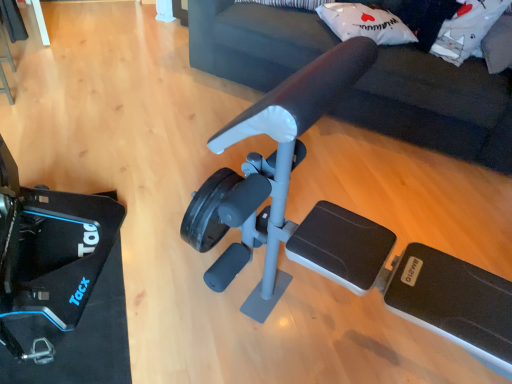
What do you see at coordinates (365, 23) in the screenshot?
I see `white matte pillow at upper center, the 2th pillow in the right-to-left sequence` at bounding box center [365, 23].

What do you see at coordinates (436, 105) in the screenshot?
I see `matte black exercise machine at center` at bounding box center [436, 105].

I want to click on white matte pillow at upper center, positioned as the first pillow in left-to-right order, so click(x=365, y=23).

Is white matte pillow at upper center, the 2th pillow in the right-to-left sequence, taller than white soft pillow at upper right, which is the second pillow from left to right?

No.

I want to click on pillow positioned vertically above the white matte pillow at upper center, the 2th pillow in the right-to-left sequence (from a real-world perspective), so click(498, 45).

Would you say white matte pillow at upper center, positioned as the first pillow in left-to-right order, is inside or outside white soft pillow at upper right, which is the second pillow from left to right?

white matte pillow at upper center, positioned as the first pillow in left-to-right order, is outside white soft pillow at upper right, which is the second pillow from left to right.

Considering the sizes of objects white matte pillow at upper center, positioned as the first pillow in left-to-right order, and white soft pillow at upper right, which is the second pillow from left to right, in the image provided, who is thinner, white matte pillow at upper center, positioned as the first pillow in left-to-right order, or white soft pillow at upper right, which is the second pillow from left to right,?

Thinner between the two is white matte pillow at upper center, positioned as the first pillow in left-to-right order.

Which is in front, white matte pillow at upper center, positioned as the first pillow in left-to-right order, or black matte tacx pedal at lower left?

black matte tacx pedal at lower left is closer to the camera.

Can you confirm if white matte pillow at upper center, the 2th pillow in the right-to-left sequence, is taller than black matte tacx pedal at lower left?

Correct, white matte pillow at upper center, the 2th pillow in the right-to-left sequence, is much taller as black matte tacx pedal at lower left.

Is white matte pillow at upper center, the 2th pillow in the right-to-left sequence, smaller than black matte tacx pedal at lower left?

Incorrect, white matte pillow at upper center, the 2th pillow in the right-to-left sequence, is not smaller in size than black matte tacx pedal at lower left.

From a real-world perspective, which is physically above, white matte pillow at upper center, positioned as the first pillow in left-to-right order, or black matte tacx pedal at lower left?

white matte pillow at upper center, positioned as the first pillow in left-to-right order.

In terms of width, does black matte tacx pedal at lower left look wider or thinner when compared to matte black exercise machine at center?

In the image, black matte tacx pedal at lower left appears to be more narrow than matte black exercise machine at center.

Which of these two, black matte tacx pedal at lower left or matte black exercise machine at center, is smaller?

Smaller between the two is black matte tacx pedal at lower left.

Locate an element on the screen. furniture behind the black matte tacx pedal at lower left is located at coordinates (436, 105).

Is black matte tacx pedal at lower left at the left side of matte black exercise machine at center?

Yes.

Considering the sizes of white matte pillow at upper center, the 2th pillow in the right-to-left sequence, and matte black exercise machine at center in the image, is white matte pillow at upper center, the 2th pillow in the right-to-left sequence, bigger or smaller than matte black exercise machine at center?

white matte pillow at upper center, the 2th pillow in the right-to-left sequence, is smaller than matte black exercise machine at center.

From the image's perspective, which is above, white matte pillow at upper center, positioned as the first pillow in left-to-right order, or matte black exercise machine at center?

From the image's view, matte black exercise machine at center is above.

From a real-world perspective, is white matte pillow at upper center, the 2th pillow in the right-to-left sequence, below matte black exercise machine at center?

Incorrect, from a real-world perspective, white matte pillow at upper center, the 2th pillow in the right-to-left sequence, is higher than matte black exercise machine at center.

Is matte black exercise machine at center inside white matte pillow at upper center, the 2th pillow in the right-to-left sequence?

No, matte black exercise machine at center is located outside of white matte pillow at upper center, the 2th pillow in the right-to-left sequence.

Considering the positions of points (508, 25) and (334, 31), is point (508, 25) farther from camera compared to point (334, 31)?

That is False.

Is white soft pillow at upper right, which is the second pillow from left to right, to the left of white matte pillow at upper center, the 2th pillow in the right-to-left sequence, from the viewer's perspective?

No.

From a real-world perspective, is white soft pillow at upper right, which is the first pillow in right-to-left order, under white matte pillow at upper center, the 2th pillow in the right-to-left sequence?

No, from a real-world perspective, white soft pillow at upper right, which is the first pillow in right-to-left order, is not under white matte pillow at upper center, the 2th pillow in the right-to-left sequence.

From the image's perspective, is black matte tacx pedal at lower left over white soft pillow at upper right, which is the first pillow in right-to-left order?

No, from the image's perspective, black matte tacx pedal at lower left is not on top of white soft pillow at upper right, which is the first pillow in right-to-left order.

Where is `the 2nd pillow positioned above the black matte tacx pedal at lower left (from a real-world perspective)`? the 2nd pillow positioned above the black matte tacx pedal at lower left (from a real-world perspective) is located at coordinates (498, 45).

Between black matte tacx pedal at lower left and white soft pillow at upper right, which is the second pillow from left to right, which one is positioned behind?

white soft pillow at upper right, which is the second pillow from left to right, is more distant.

Measure the distance between black matte tacx pedal at lower left and white soft pillow at upper right, which is the second pillow from left to right.

black matte tacx pedal at lower left is 6.88 feet from white soft pillow at upper right, which is the second pillow from left to right.

Can black matte tacx pedal at lower left be found inside matte black exercise machine at center?

No, black matte tacx pedal at lower left is not inside matte black exercise machine at center.

From the image's perspective, does matte black exercise machine at center appear higher than black matte tacx pedal at lower left?

Correct, matte black exercise machine at center appears higher than black matte tacx pedal at lower left in the image.

How distant is matte black exercise machine at center from black matte tacx pedal at lower left?

matte black exercise machine at center is 1.65 meters away from black matte tacx pedal at lower left.

Where is `video camera that appears on the left of matte black exercise machine at center`? This screenshot has height=384, width=512. video camera that appears on the left of matte black exercise machine at center is located at coordinates (49, 253).

In the image, there is a white soft pillow at upper right, which is the second pillow from left to right. At what (x,y) coordinates should I click in order to perform the action: click on pillow below it (from a real-world perspective). Please return your answer as a coordinate pair (x, y). Looking at the image, I should click on (365, 23).

Where is `the 2nd pillow behind the black matte tacx pedal at lower left, starting your count from the anchor`? the 2nd pillow behind the black matte tacx pedal at lower left, starting your count from the anchor is located at coordinates (365, 23).

From the image, which object appears to be nearer to white matte pillow at upper center, the 2th pillow in the right-to-left sequence, black matte tacx pedal at lower left or white soft pillow at upper right, which is the second pillow from left to right?

white soft pillow at upper right, which is the second pillow from left to right.

Estimate the real-world distances between objects in this image. Which object is further from white soft pillow at upper right, which is the second pillow from left to right, white matte pillow at upper center, positioned as the first pillow in left-to-right order, or black matte tacx pedal at lower left?

Among the two, black matte tacx pedal at lower left is located further to white soft pillow at upper right, which is the second pillow from left to right.

From the image, which object appears to be nearer to black matte tacx pedal at lower left, white soft pillow at upper right, which is the second pillow from left to right, or white matte pillow at upper center, positioned as the first pillow in left-to-right order?

The object closer to black matte tacx pedal at lower left is white matte pillow at upper center, positioned as the first pillow in left-to-right order.

Estimate the real-world distances between objects in this image. Which object is closer to matte black exercise machine at center, white matte pillow at upper center, positioned as the first pillow in left-to-right order, or white soft pillow at upper right, which is the second pillow from left to right?

white matte pillow at upper center, positioned as the first pillow in left-to-right order, is closer to matte black exercise machine at center.

Estimate the real-world distances between objects in this image. Which object is closer to matte black exercise machine at center, white matte pillow at upper center, the 2th pillow in the right-to-left sequence, or black matte tacx pedal at lower left?

white matte pillow at upper center, the 2th pillow in the right-to-left sequence.

Considering their positions, is white matte pillow at upper center, positioned as the first pillow in left-to-right order, positioned closer to black matte tacx pedal at lower left than white soft pillow at upper right, which is the second pillow from left to right?

Based on the image, white matte pillow at upper center, positioned as the first pillow in left-to-right order, appears to be nearer to black matte tacx pedal at lower left.

Considering their positions, is white matte pillow at upper center, the 2th pillow in the right-to-left sequence, positioned further to white soft pillow at upper right, which is the second pillow from left to right, than matte black exercise machine at center?

white matte pillow at upper center, the 2th pillow in the right-to-left sequence, lies further to white soft pillow at upper right, which is the second pillow from left to right, than the other object.

Considering their positions, is matte black exercise machine at center positioned further to white soft pillow at upper right, which is the second pillow from left to right, than black matte tacx pedal at lower left?

black matte tacx pedal at lower left is further to white soft pillow at upper right, which is the second pillow from left to right.

The width and height of the screenshot is (512, 384). I want to click on pillow situated between black matte tacx pedal at lower left and white soft pillow at upper right, which is the second pillow from left to right, from left to right, so [x=365, y=23].

Locate an element on the screen. This screenshot has height=384, width=512. pillow between black matte tacx pedal at lower left and matte black exercise machine at center from left to right is located at coordinates (365, 23).

Locate an element on the screen. Image resolution: width=512 pixels, height=384 pixels. furniture between white matte pillow at upper center, positioned as the first pillow in left-to-right order, and white soft pillow at upper right, which is the first pillow in right-to-left order, from left to right is located at coordinates (436, 105).

Find the location of `furniture between black matte tacx pedal at lower left and white soft pillow at upper right, which is the second pillow from left to right, in the horizontal direction`. furniture between black matte tacx pedal at lower left and white soft pillow at upper right, which is the second pillow from left to right, in the horizontal direction is located at coordinates (436, 105).